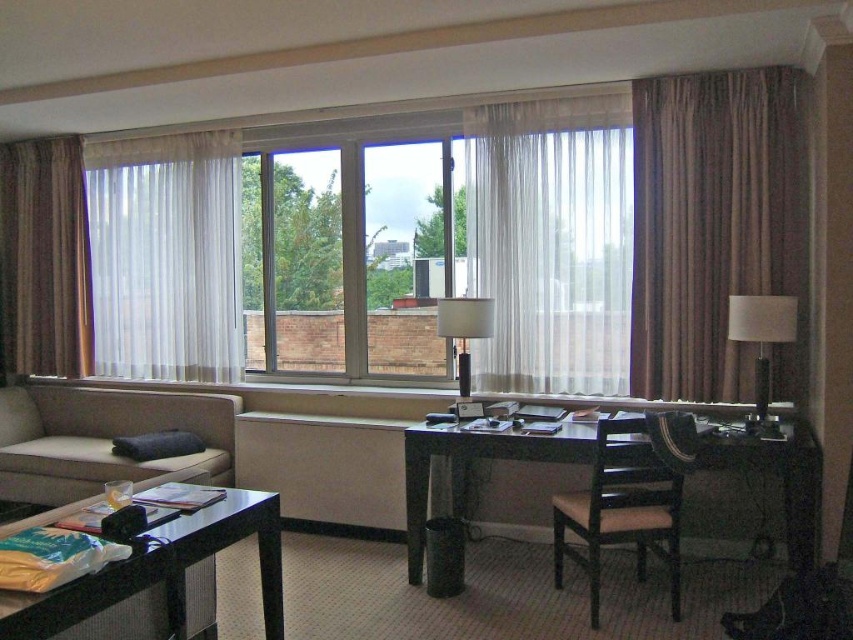
You are standing at the entrance of the hotel room and want to sit on the beige fabric couch at left. Based on its position coordinates, is the couch closer to the entrance or the window?

The beige fabric couch at left is positioned at point (102, 438). Since the coordinates are relative to the room, the couch is closer to the entrance than the window.

You are moving a 7.5 feet long sofa into the hotel room. The sofa needs to be placed between the white sheer curtain at left and the dark wood desk at center. Can the sofa fit in that space?

The distance between the white sheer curtain at left and the dark wood desk at center is 7.91 feet, which is slightly longer than the 7.5 feet sofa. Therefore, the sofa can fit in the space between them.